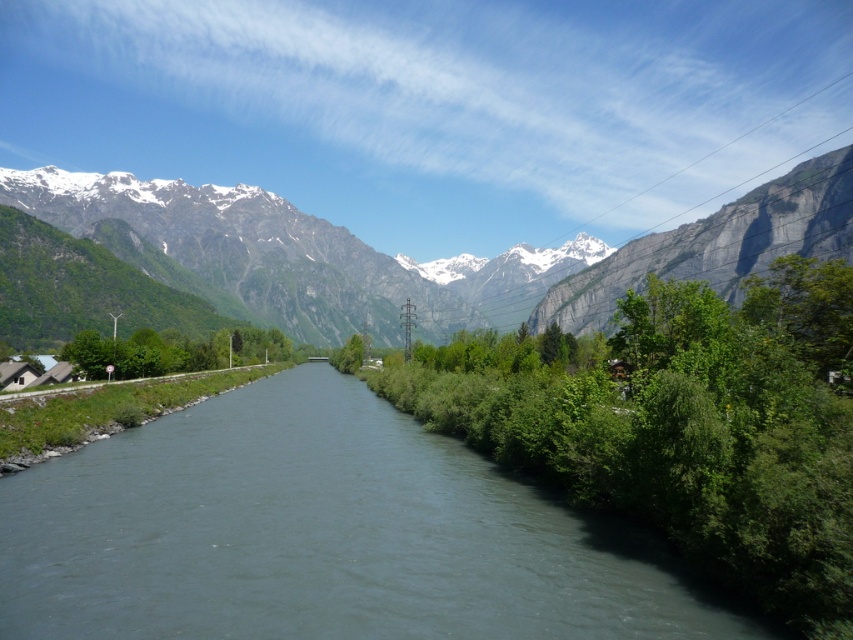
Question: Can you confirm if green grassy river at center is bigger than gray rock cliff at upper right?

Choices:
 (A) no
 (B) yes

Answer: (A)

Question: Is snowy granite mountains at upper center smaller than gray rock cliff at upper right?

Choices:
 (A) no
 (B) yes

Answer: (A)

Question: Which of the following is the closest to the observer?

Choices:
 (A) snowy granite mountains at upper center
 (B) gray rock cliff at upper right
 (C) green grassy river at center

Answer: (C)

Question: Is green grassy river at center above snowy granite mountains at upper center?

Choices:
 (A) no
 (B) yes

Answer: (A)

Question: Which point appears farthest from the camera in this image?

Choices:
 (A) (473, 310)
 (B) (558, 304)

Answer: (A)

Question: Based on their relative distances, which object is farther from the snowy granite mountains at upper center?

Choices:
 (A) green grassy river at center
 (B) gray rock cliff at upper right

Answer: (A)